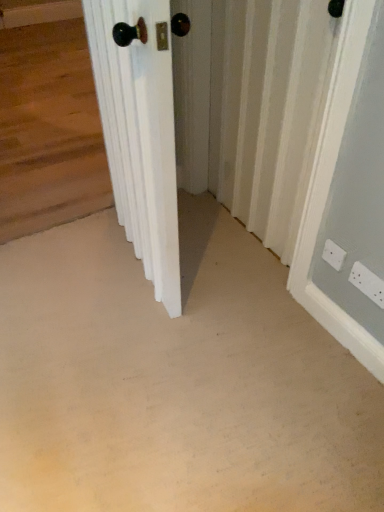
Locate an element on the screen. The image size is (384, 512). vacant area that is in front of white wooden door at center is located at coordinates (141, 353).